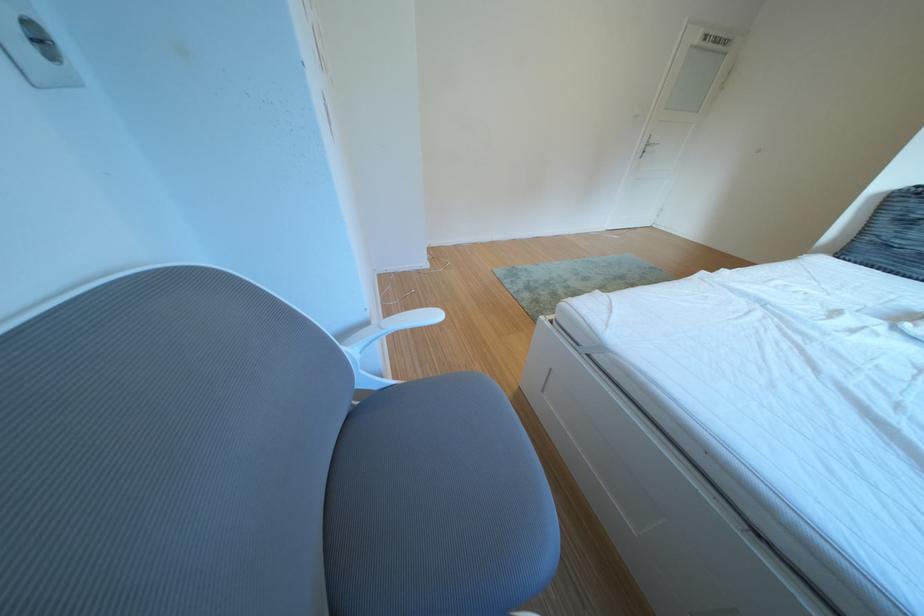
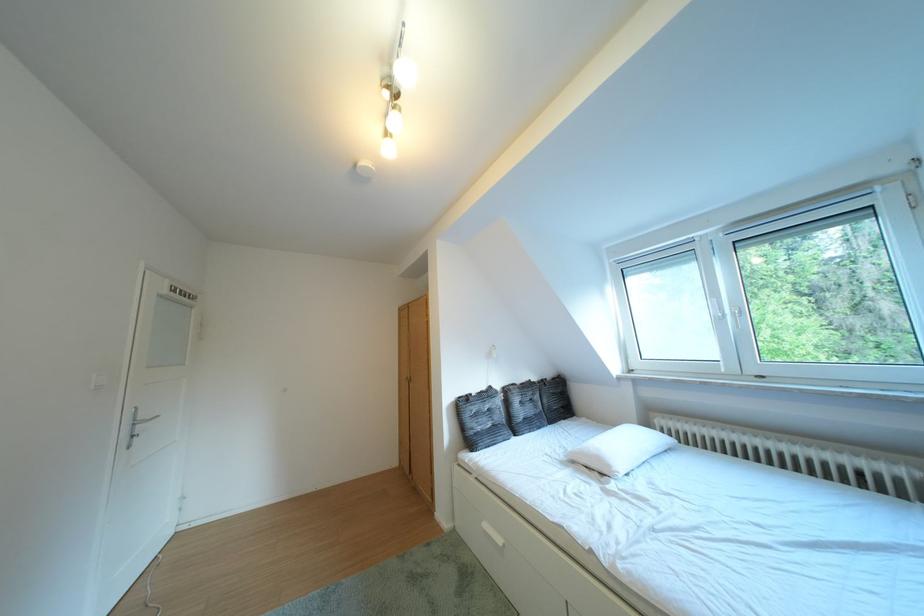
The point at [881,244] is marked in the first image. Where is the corresponding point in the second image?

(484, 438)